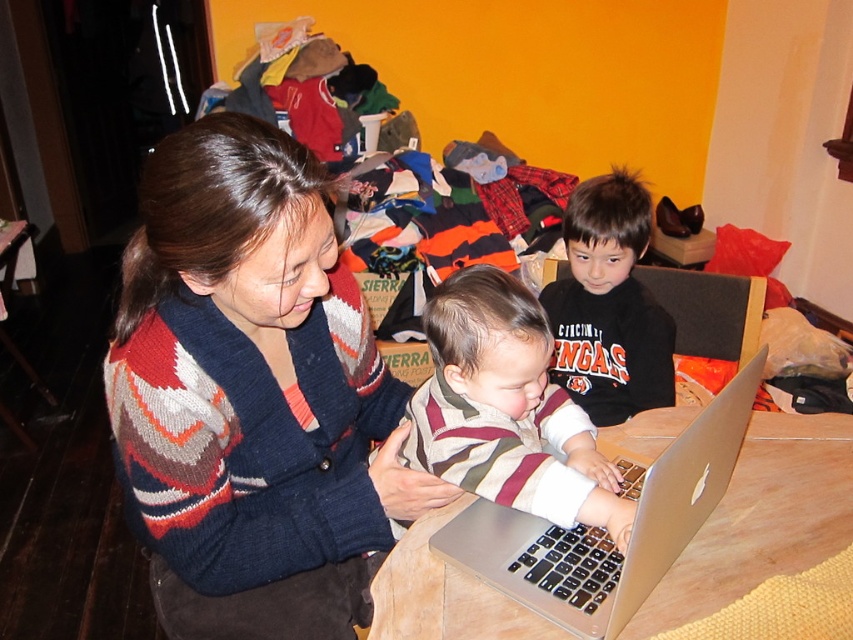
You are trying to place a 15 cm wide notebook on the table between the knitted sweater at center and the silver metallic laptop at center. Can the notebook fit in that space?

The knitted sweater at center might be wider than the silver metallic laptop at center, so the space between them may not be sufficient to fit a 15 cm wide notebook. Check the actual dimensions before placing it.

You are a photographer positioned in front of the striped fabric baby at center and the dark blue fabric at lower center. Which object should you focus on first to ensure it appears larger in the photo?

The striped fabric baby at center should be focused on first because it is closer to the viewer than the dark blue fabric at lower center, making it appear larger when in focus.